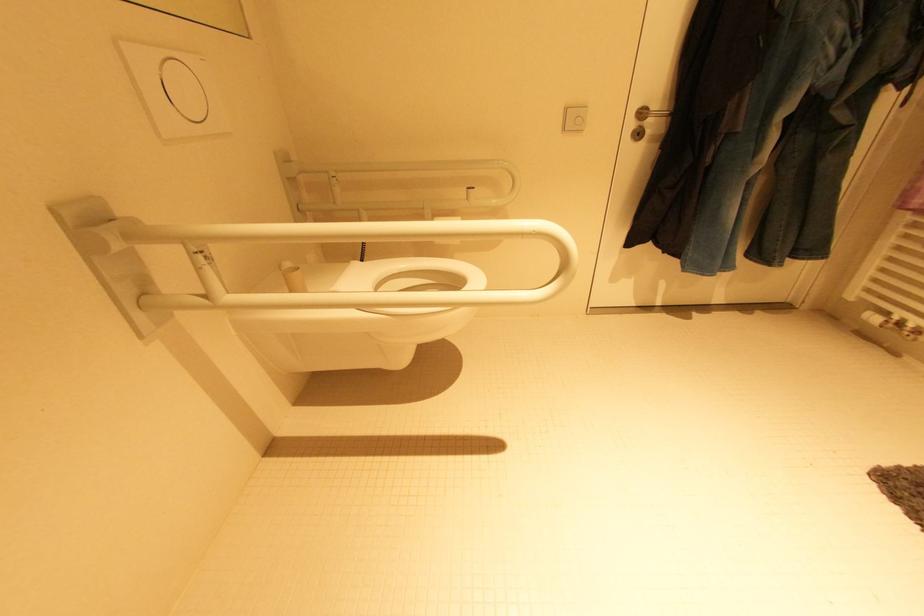
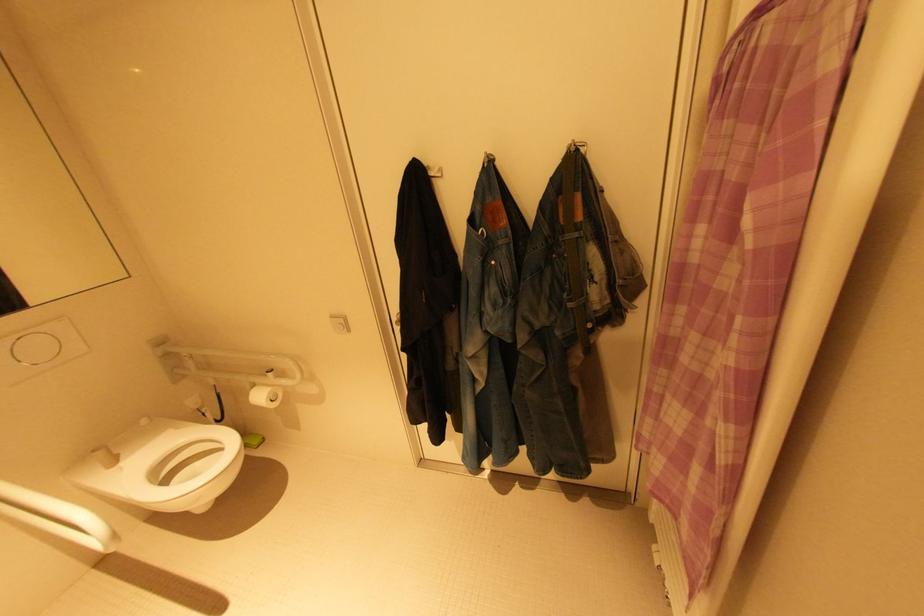
Question: In a continuous first-person perspective shot, in which direction is the camera moving?

Choices:
 (A) Left
 (B) Right
 (C) Forward
 (D) Backward

Answer: (B)